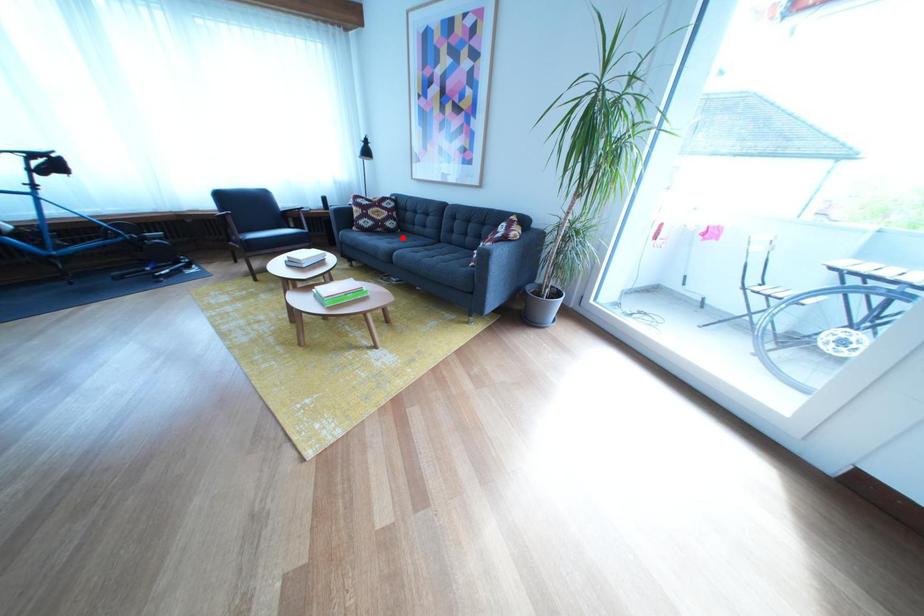
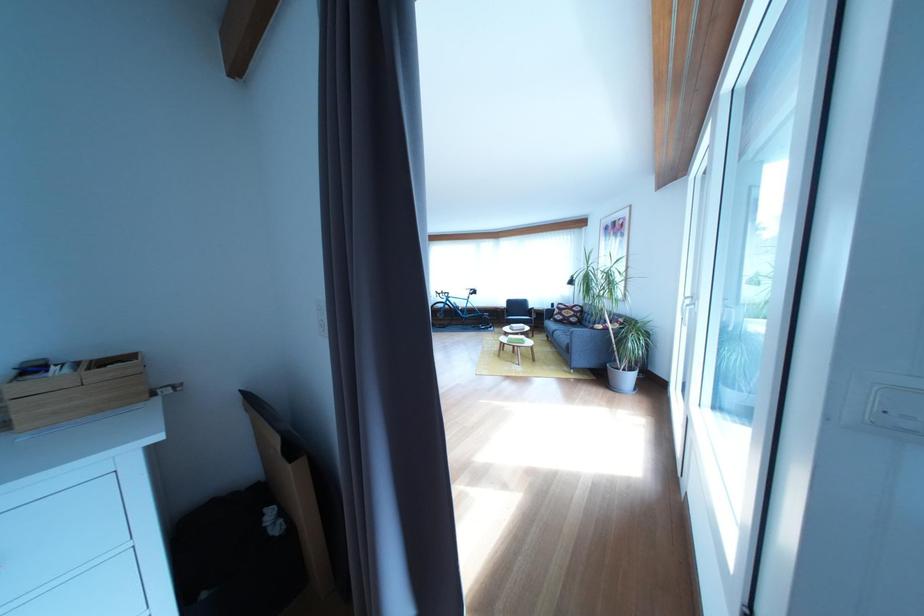
In the second image, find the point that corresponds to the highlighted location in the first image.

(585, 330)